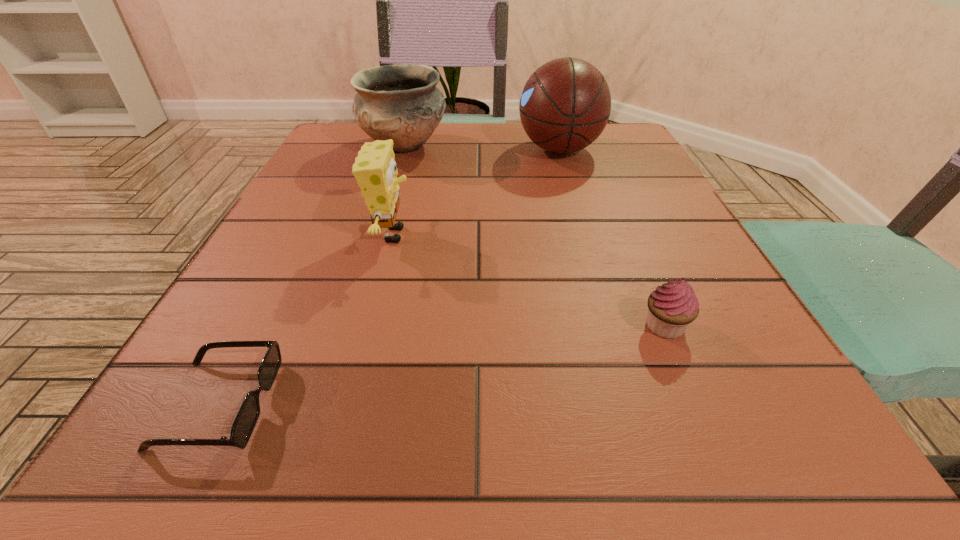
Locate an element on the screen. The width and height of the screenshot is (960, 540). vacant point located between the sunglasses and the fourth farthest object is located at coordinates (442, 365).

Where is `unoccupied position between the pottery and the basketball`? The height and width of the screenshot is (540, 960). unoccupied position between the pottery and the basketball is located at coordinates (482, 147).

Where is `free spot between the third nearest object and the sunglasses`? Image resolution: width=960 pixels, height=540 pixels. free spot between the third nearest object and the sunglasses is located at coordinates (305, 319).

Find the location of a particular element. The width and height of the screenshot is (960, 540). free space between the sunglasses and the fourth farthest object is located at coordinates (442, 365).

Locate an element on the screen. The height and width of the screenshot is (540, 960). free space between the sunglasses and the tallest object is located at coordinates (389, 276).

In order to click on vacant area between the pottery and the third farthest object in this screenshot , I will do `click(398, 190)`.

Locate an element on the screen. This screenshot has width=960, height=540. vacant space that is in between the tallest object and the shortest object is located at coordinates (389, 276).

You are a GUI agent. You are given a task and a screenshot of the screen. Output one action in this format:
    pyautogui.click(x=<x>, y=<y>)
    Task: Click on the vacant area that lies between the basketball and the shortest object
    The width and height of the screenshot is (960, 540).
    Given the screenshot: What is the action you would take?
    pyautogui.click(x=389, y=276)

I want to click on vacant space that's between the basketball and the sponge, so click(476, 192).

I want to click on object that is the second closest one to the sponge, so click(x=247, y=417).